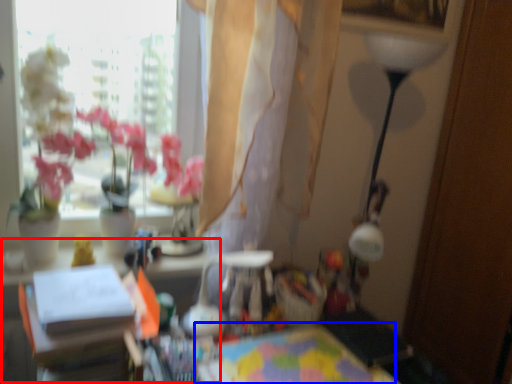
Question: Which object is further to the camera taking this photo, table (highlighted by a red box) or table (highlighted by a blue box)?

Choices:
 (A) table
 (B) table

Answer: (B)